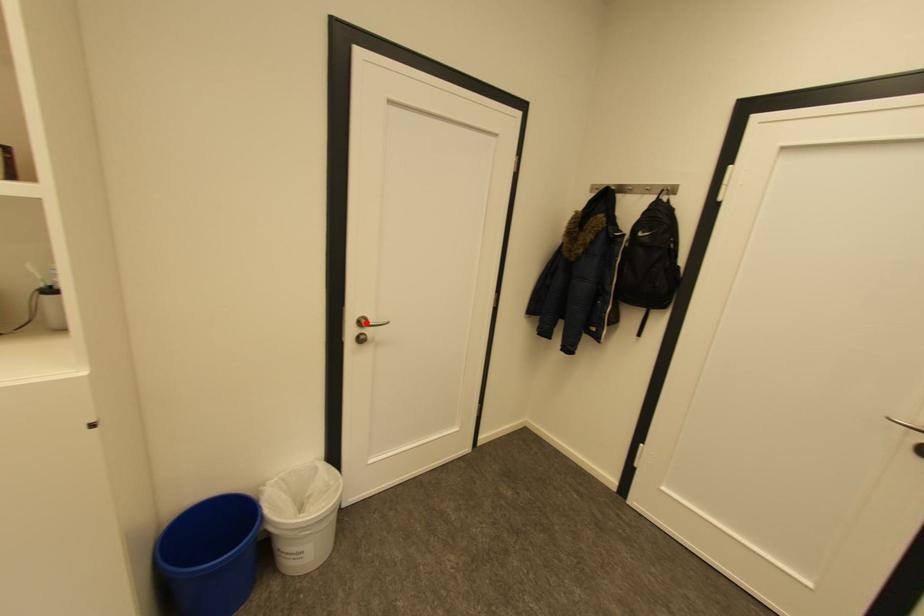
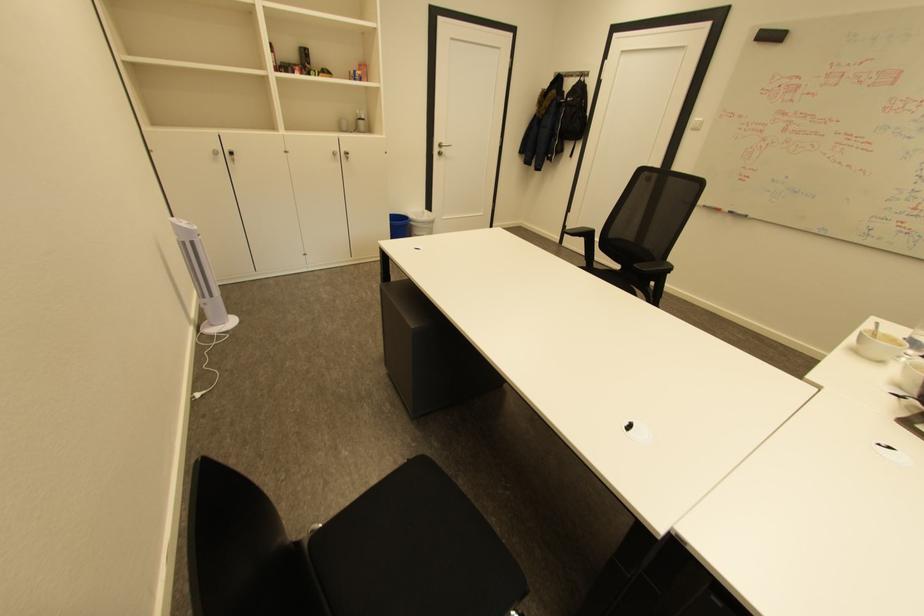
Where in the second image is the point corresponding to the highlighted location from the first image?

(446, 146)